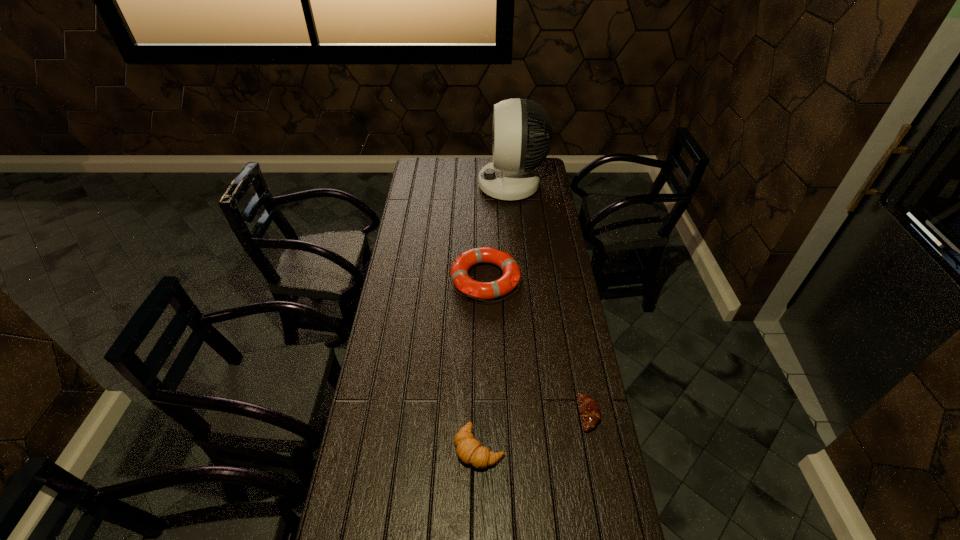
Locate an element on the screen. the tallest object is located at coordinates (511, 176).

Locate an element on the screen. The height and width of the screenshot is (540, 960). fan is located at coordinates (511, 176).

Where is `life buoy`? This screenshot has width=960, height=540. life buoy is located at coordinates (511, 276).

Identify the location of the second farthest object. (511, 276).

The width and height of the screenshot is (960, 540). I want to click on the left crescent roll, so click(x=468, y=449).

I want to click on the third tallest object, so click(468, 449).

At what (x,y) coordinates should I click in order to perform the action: click on the right crescent roll. Please return your answer as a coordinate pair (x, y). Looking at the image, I should click on (589, 409).

At what (x,y) coordinates should I click in order to perform the action: click on the shorter crescent roll. Please return your answer as a coordinate pair (x, y). Looking at the image, I should click on (589, 409).

Locate an element on the screen. The height and width of the screenshot is (540, 960). vacant point located on the grille of the farthest object is located at coordinates (462, 185).

Find the location of a particular element. vacant position located on the grille of the farthest object is located at coordinates (408, 185).